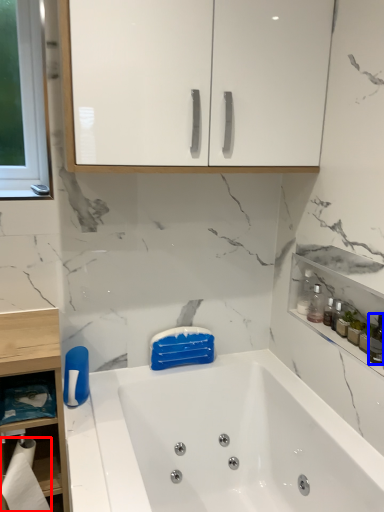
Question: Which of the following is the farthest to the observer, toilet paper (highlighted by a red box) or toiletry (highlighted by a blue box)?

Choices:
 (A) toilet paper
 (B) toiletry

Answer: (A)